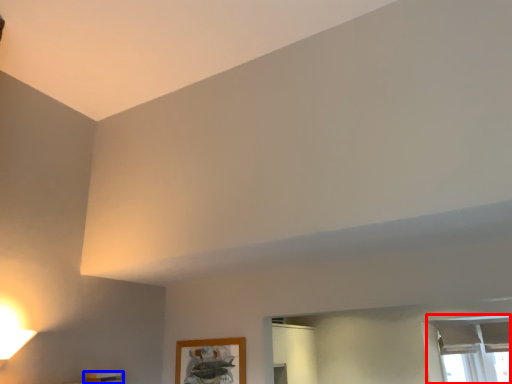
Question: Which object appears farthest to the camera in this image, window (highlighted by a red box) or furniture (highlighted by a blue box)?

Choices:
 (A) window
 (B) furniture

Answer: (A)